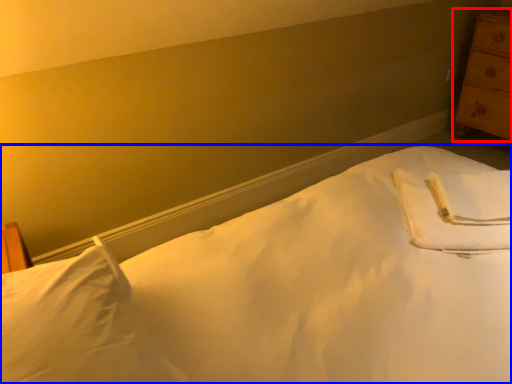
Question: Which point is closer to the camera, chest of drawers (highlighted by a red box) or bed (highlighted by a blue box)?

Choices:
 (A) chest of drawers
 (B) bed

Answer: (B)